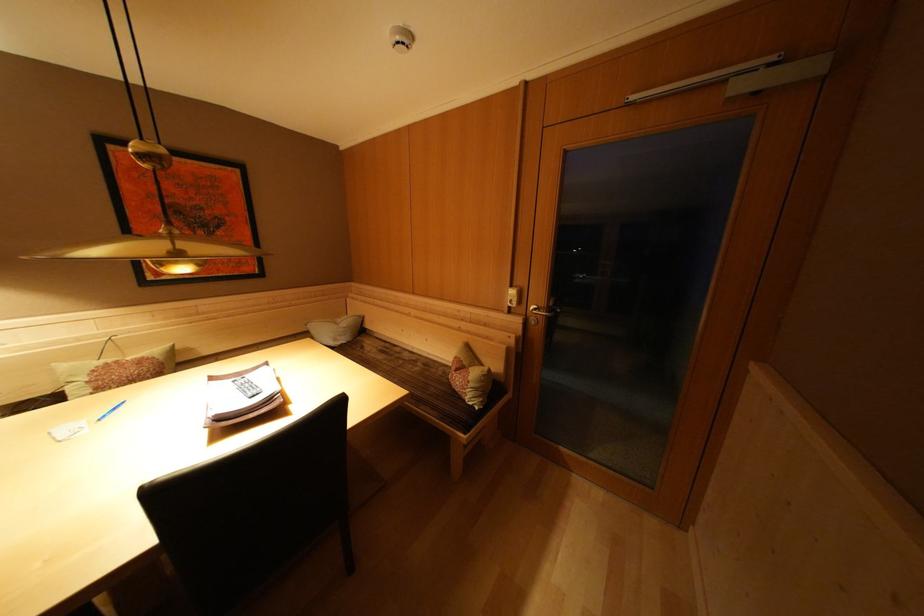
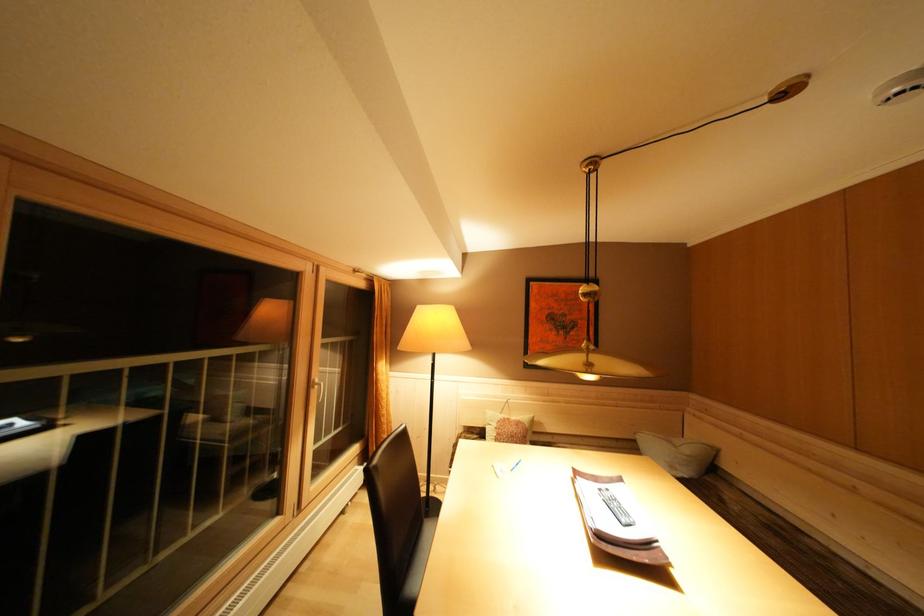
The point at (351,329) is marked in the first image. Where is the corresponding point in the second image?

(695, 456)